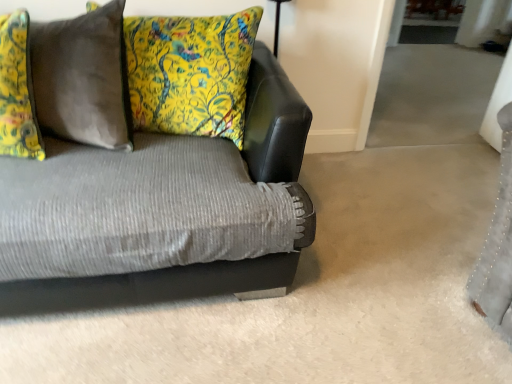
This screenshot has width=512, height=384. I want to click on free space to the right of textured gray couch at center, so click(370, 255).